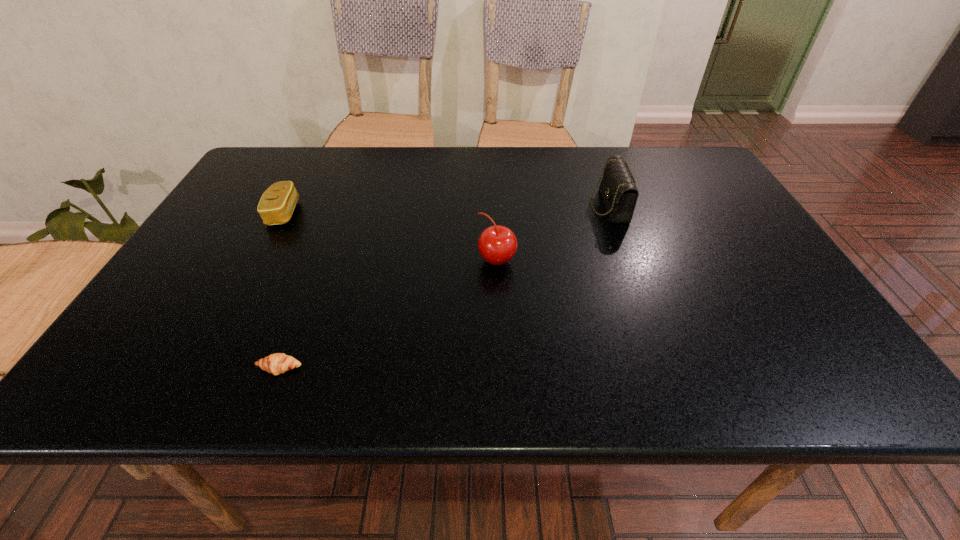
This screenshot has height=540, width=960. Identify the location of the second nearest object. (497, 244).

At what (x,y) coordinates should I click in order to perform the action: click on cherry. Please return your answer as a coordinate pair (x, y). This screenshot has height=540, width=960. Looking at the image, I should click on (497, 244).

Identify the location of the taller clutch bag. (618, 190).

Where is `the rightmost object`? This screenshot has width=960, height=540. the rightmost object is located at coordinates (618, 190).

Find the location of a particular element. The image size is (960, 540). the third tallest object is located at coordinates (277, 203).

Where is `the leftmost object`? Image resolution: width=960 pixels, height=540 pixels. the leftmost object is located at coordinates (277, 203).

The width and height of the screenshot is (960, 540). What are the coordinates of `pastry` in the screenshot? It's located at (278, 363).

Where is `the second object from left to right`? the second object from left to right is located at coordinates (278, 363).

Identify the location of vacant space located 0.180m on the back of the second nearest object. (494, 205).

Find the location of a particular element. free space located 0.100m on the front flap of the rightmost object is located at coordinates (554, 206).